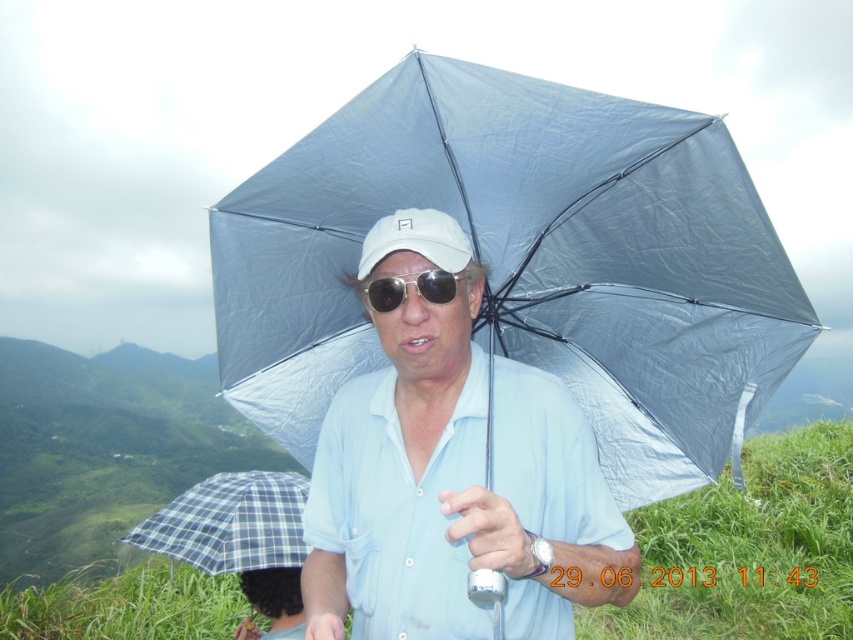
Question: Does plaid fabric umbrella at lower left lie in front of gold metallic sunglasses at center?

Choices:
 (A) yes
 (B) no

Answer: (B)

Question: Which object is positioned farthest from the matte blue shirt at center?

Choices:
 (A) transparent fabric umbrella at center
 (B) plaid fabric umbrella at lower left
 (C) gold metallic sunglasses at center
 (D) white matte baseball cap at center

Answer: (B)

Question: Which of the following is the closest to the observer?

Choices:
 (A) white matte baseball cap at center
 (B) matte blue shirt at center
 (C) gold metallic sunglasses at center
 (D) transparent fabric umbrella at center

Answer: (B)

Question: Can you confirm if dark brown hair at center is thinner than gold metallic sunglasses at center?

Choices:
 (A) yes
 (B) no

Answer: (B)

Question: Is matte blue shirt at center positioned in front of gold metallic sunglasses at center?

Choices:
 (A) yes
 (B) no

Answer: (A)

Question: Which object is positioned farthest from the gold metallic sunglasses at center?

Choices:
 (A) plaid fabric umbrella at lower left
 (B) transparent fabric umbrella at center
 (C) dark brown hair at center

Answer: (A)